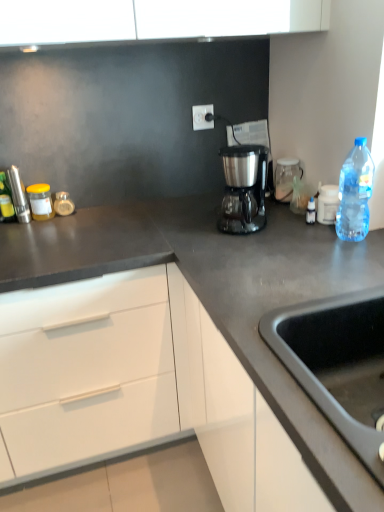
Find the location of a particular element. The image size is (384, 512). vacant area that lies between satin metallic coffee maker at center and white plastic container at upper right, arranged as the 1th appliance when viewed from the right is located at coordinates (284, 224).